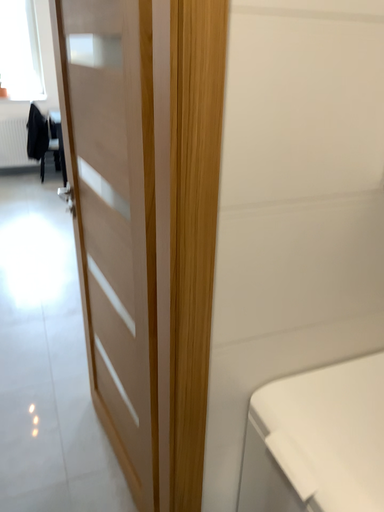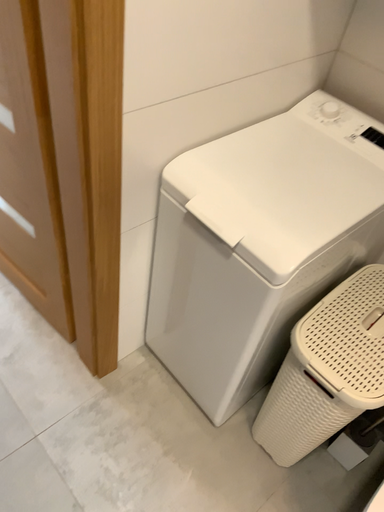
Question: How did the camera likely rotate when shooting the video?

Choices:
 (A) rotated right
 (B) rotated left

Answer: (A)